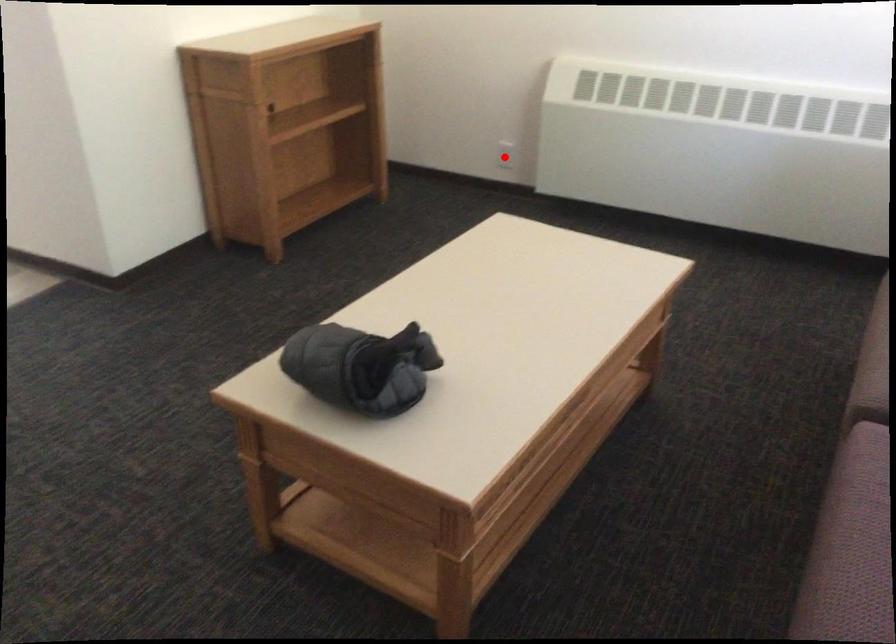
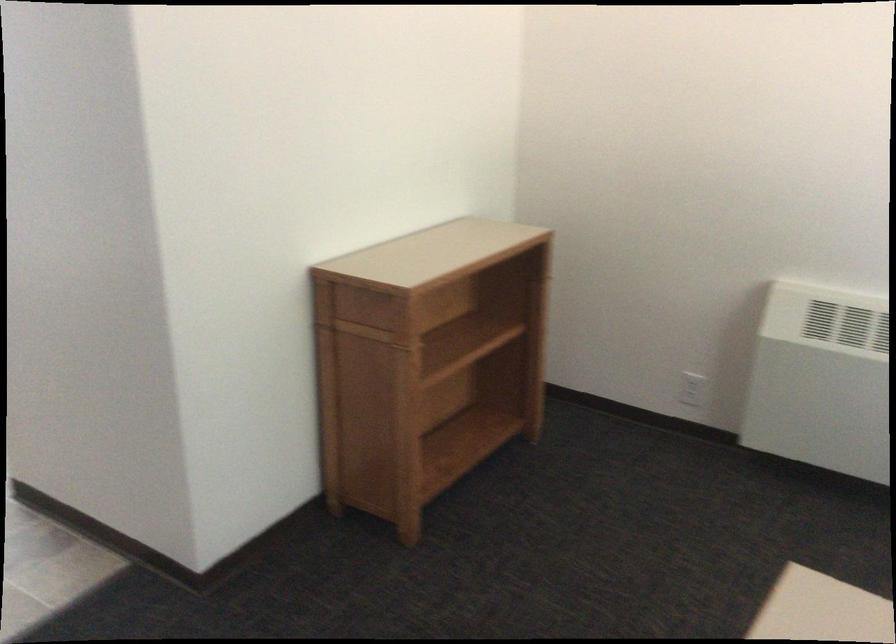
Where in the second image is the point corresponding to the highlighted location from the first image?

(692, 389)